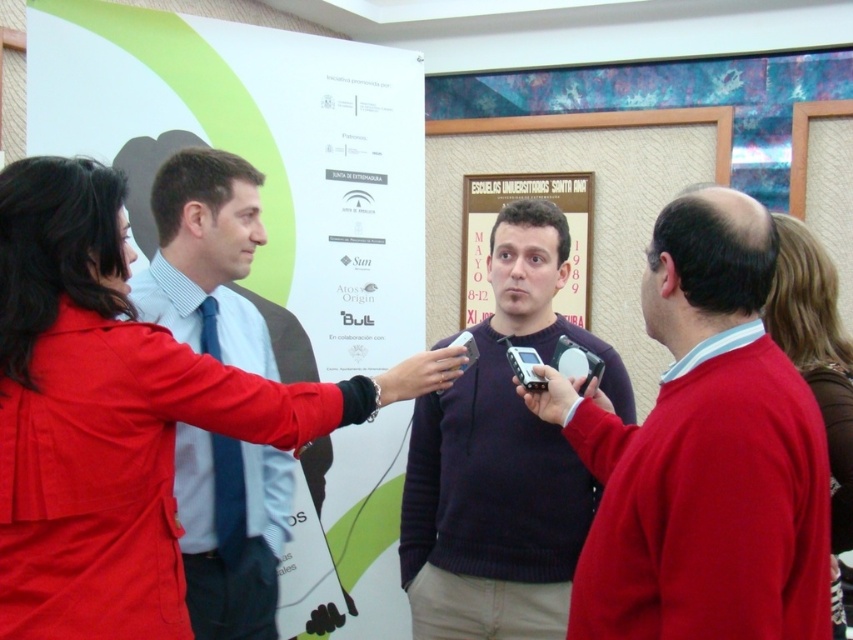
Question: Is the position of matte black phone at center more distant than that of light blue shirt at center?

Choices:
 (A) no
 (B) yes

Answer: (A)

Question: Which object is closer to the camera taking this photo?

Choices:
 (A) brown leather jacket at upper right
 (B) dark purple sweater at center
 (C) white paper poster at center
 (D) matte paper poster at center

Answer: (A)

Question: Which point is closer to the camera?

Choices:
 (A) white paper poster at center
 (B) matte paper poster at center

Answer: (A)

Question: From the image, what is the correct spatial relationship of white paper poster at center in relation to brown leather jacket at upper right?

Choices:
 (A) below
 (B) above

Answer: (B)

Question: Among these points, which one is nearest to the camera?

Choices:
 (A) (407, 342)
 (B) (485, 228)
 (C) (799, 348)
 (D) (223, 320)

Answer: (C)

Question: Is white paper poster at center to the left of dark purple sweater at center from the viewer's perspective?

Choices:
 (A) no
 (B) yes

Answer: (B)